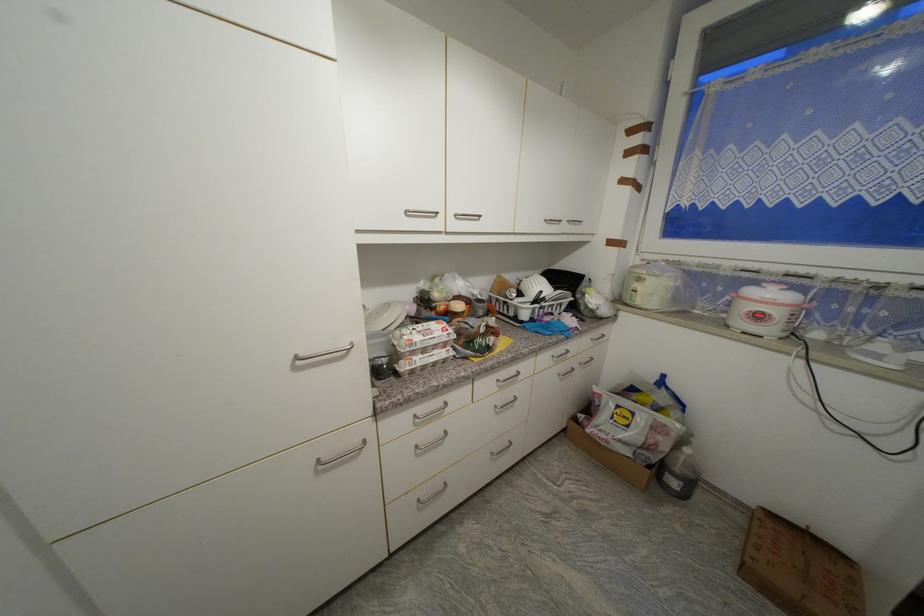
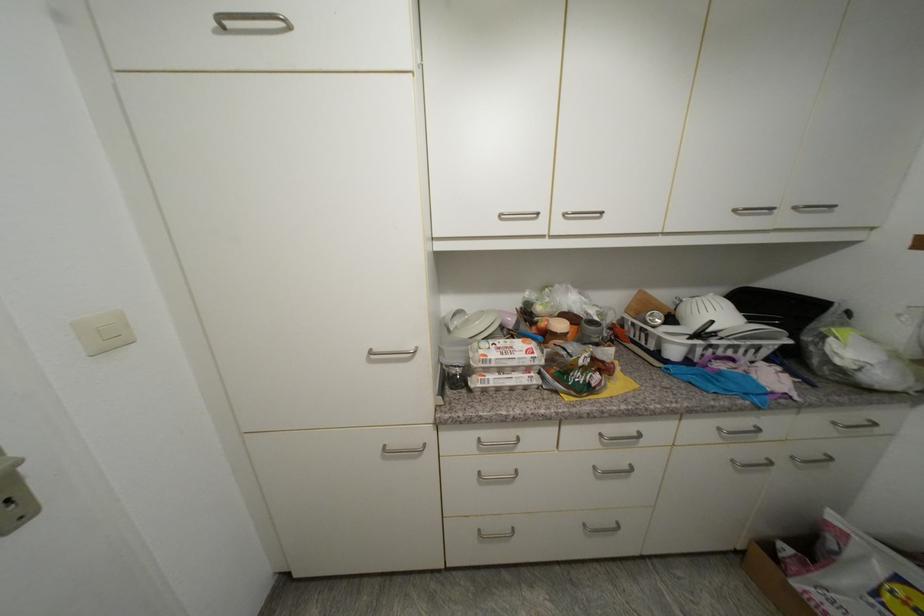
Locate, in the second image, the point that corresponds to the point at 484,302 in the first image.

(598, 323)